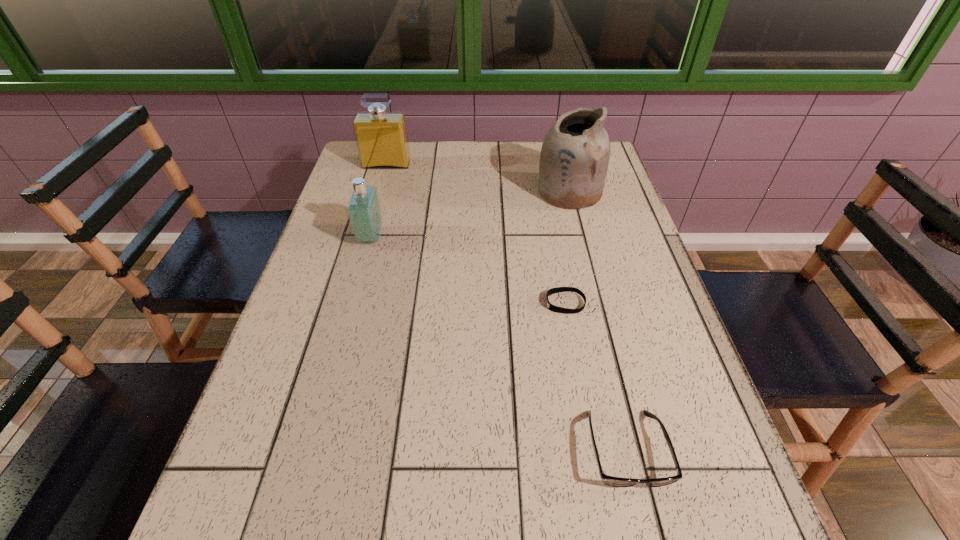
You are a GUI agent. You are given a task and a screenshot of the screen. Output one action in this format:
    pyautogui.click(x=<x>, y=<y>)
    Task: Click on the second farthest object
    This screenshot has width=960, height=540.
    Given the screenshot: What is the action you would take?
    pyautogui.click(x=574, y=158)

Locate an element on the screen. the taller perfume is located at coordinates (381, 137).

In order to click on the farther perfume in this screenshot , I will do `click(381, 137)`.

Image resolution: width=960 pixels, height=540 pixels. I want to click on the nearer perfume, so click(x=363, y=208).

The image size is (960, 540). I want to click on the third nearest object, so pyautogui.click(x=363, y=208).

Locate an element on the screen. The height and width of the screenshot is (540, 960). the second shortest object is located at coordinates (612, 481).

At what (x,y) coordinates should I click in order to perform the action: click on the nearest object. Please return your answer as a coordinate pair (x, y). The height and width of the screenshot is (540, 960). Looking at the image, I should click on (612, 481).

The height and width of the screenshot is (540, 960). Identify the location of the second nearest object. (551, 307).

Locate an element on the screen. This screenshot has height=540, width=960. the shortest object is located at coordinates (551, 307).

This screenshot has width=960, height=540. I want to click on vacant region located 0.090m on the front of the second farthest object, so click(x=579, y=231).